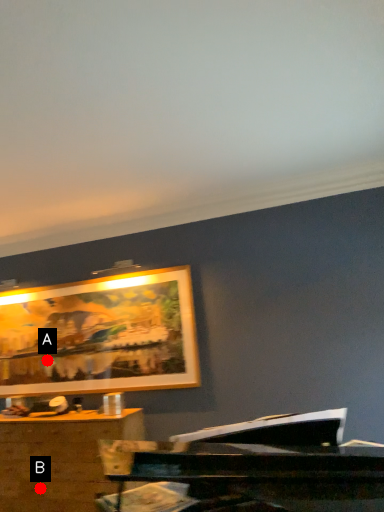
Question: Two points are circled on the image, labeled by A and B beside each circle. Which point appears closest to the camera in this image?

Choices:
 (A) A is closer
 (B) B is closer

Answer: (B)